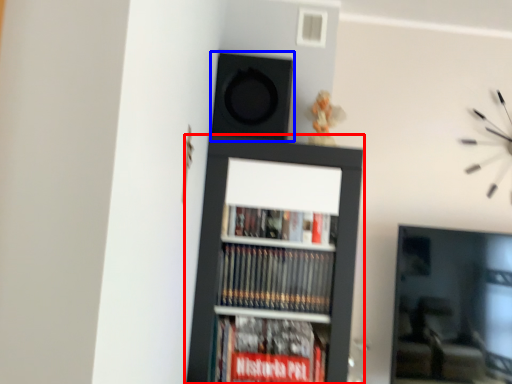
Question: Which of the following is the farthest to the observer, bookcase (highlighted by a red box) or speaker (highlighted by a blue box)?

Choices:
 (A) bookcase
 (B) speaker

Answer: (B)